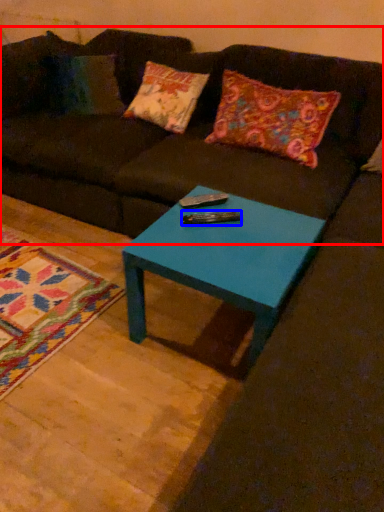
Question: Among these objects, which one is farthest to the camera, studio couch (highlighted by a red box) or remote (highlighted by a blue box)?

Choices:
 (A) studio couch
 (B) remote

Answer: (B)